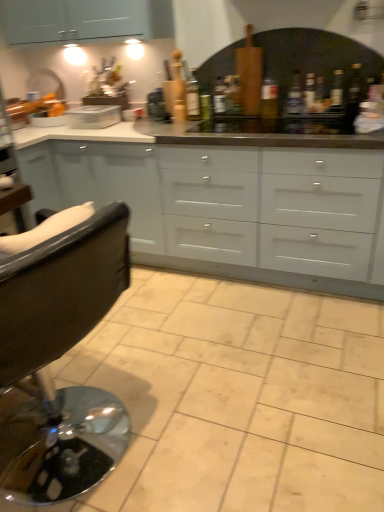
In order to click on blank space to the left of matte glass bottle at center, marked as the third bottle in a left-to-right arrangement in this screenshot , I will do `click(243, 122)`.